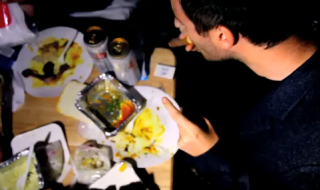
Locate an element on the screen. The height and width of the screenshot is (190, 320). wooden table is located at coordinates tap(34, 106).